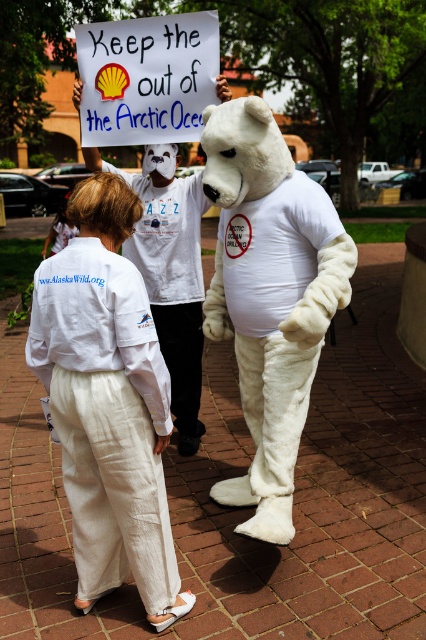
Is white linen pants at lower left thinner than white cotton pants at lower center?

Correct, white linen pants at lower left's width is less than white cotton pants at lower center's.

Is white linen pants at lower left further to the viewer compared to white cotton pants at lower center?

That is False.

Locate an element on the screen. white linen pants at lower left is located at coordinates (108, 403).

Who is more forward, (111, 186) or (310, 257)?

Point (111, 186)

Can you confirm if white linen pants at lower left is thinner than white furry bear at center?

Yes.

Is point (89, 456) positioned after point (278, 323)?

No, (89, 456) is closer to viewer.

Where is `white linen pants at lower left`? This screenshot has width=426, height=640. white linen pants at lower left is located at coordinates (108, 403).

Can you confirm if white furry bear at center is bigger than white cotton pants at lower center?

Yes, white furry bear at center is bigger than white cotton pants at lower center.

Is white furry bear at center in front of white cotton pants at lower center?

That is True.

Locate an element on the screen. white furry bear at center is located at coordinates (270, 296).

You are a GUI agent. You are given a task and a screenshot of the screen. Output one action in this format:
    pyautogui.click(x=<x>, y=<y>)
    Task: Click on the white furry bear at center
    This screenshot has height=640, width=426.
    Given the screenshot: What is the action you would take?
    [x=270, y=296]